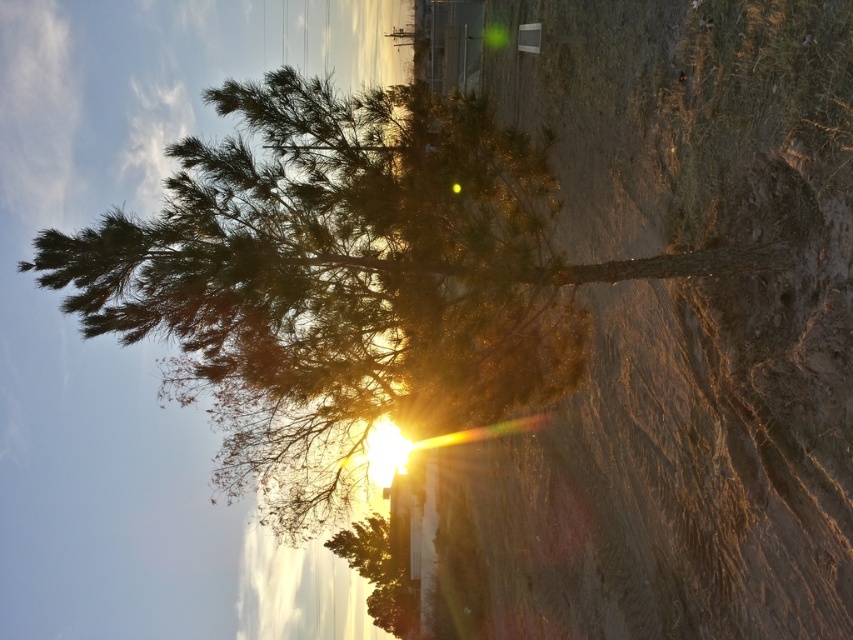
You are standing at the edge of a path and see the brown dirt cliff at center and the green leafy tree at center. Which object is closer to you?

The brown dirt cliff at center is closer to you because it is in front of the green leafy tree at center.

You are standing in the middle of the scene and want to walk towards the green leafy tree at center. Will you have to climb over the brown dirt cliff at center first?

The brown dirt cliff at center is positioned under the green leafy tree at center, so you would not need to climb over it since it is located beneath the tree rather than in front of it.

You are standing at the center of the image and want to locate the brown dirt cliff at center. What are the coordinates where you should look?

The brown dirt cliff at center is located at coordinates point (672, 326).